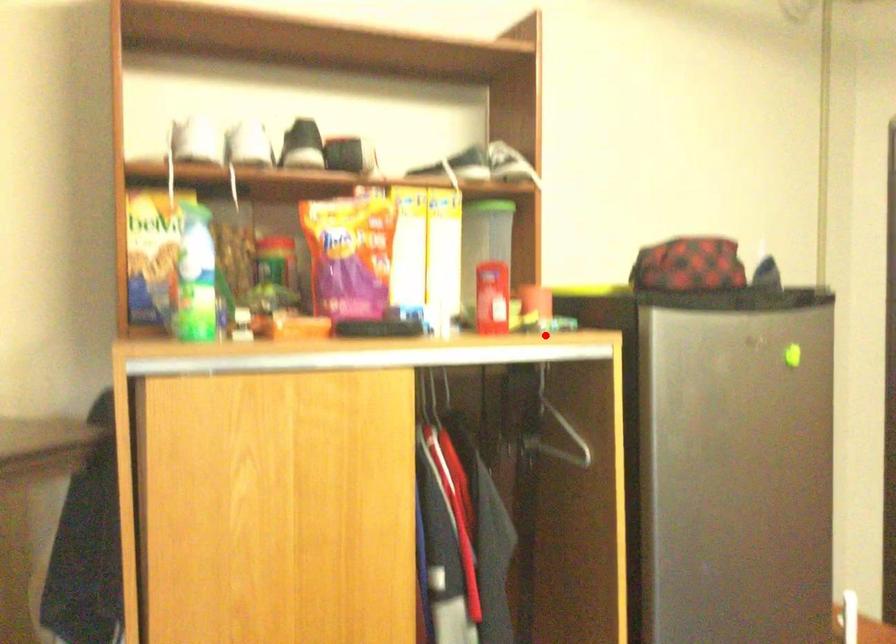
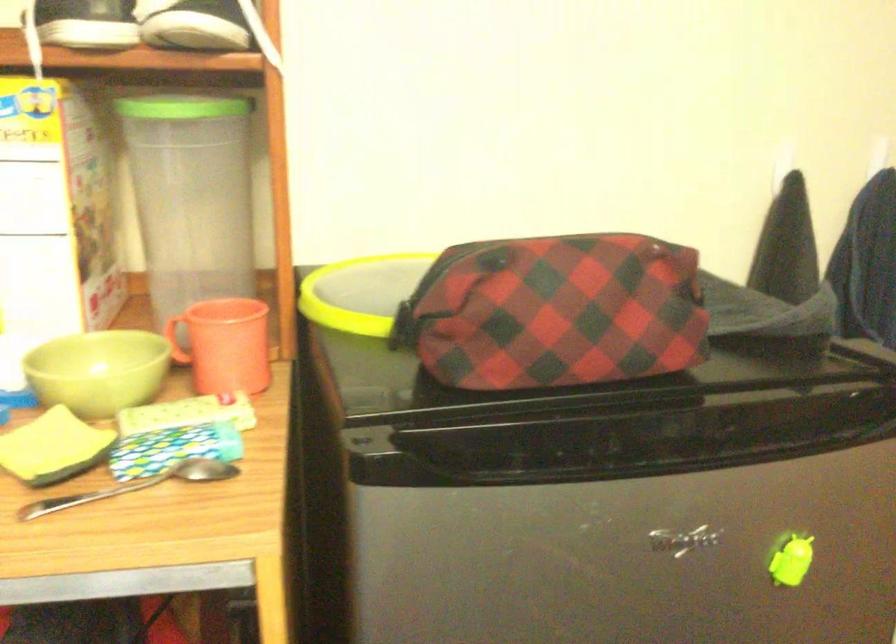
Locate, in the second image, the point that corresponds to the highlighted location in the first image.

(135, 486)